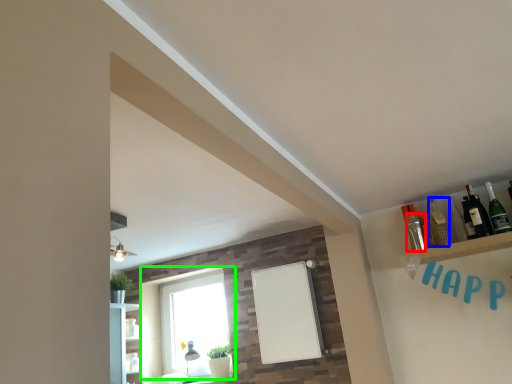
Question: Which is nearer to the bottle (highlighted by a red box)? bottle (highlighted by a blue box) or window (highlighted by a green box).

Choices:
 (A) bottle
 (B) window

Answer: (A)